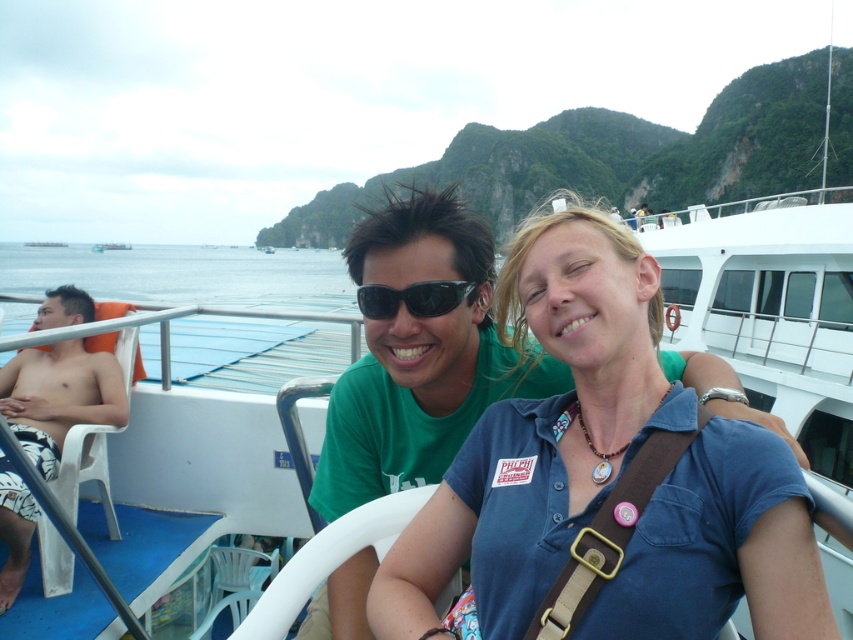
Does blue cotton shirt at center appear over white textured shorts at left?

Incorrect, blue cotton shirt at center is not positioned above white textured shorts at left.

Looking at this image, between blue cotton shirt at center and white textured shorts at left, which one appears on the right side from the viewer's perspective?

blue cotton shirt at center

Which is in front, point (519, 285) or point (41, 372)?

Point (519, 285) is more forward.

This screenshot has width=853, height=640. In order to click on blue cotton shirt at center in this screenshot , I will do `click(540, 432)`.

Between blue cotton shirt at center and black plastic sunglasses at center, which one has less height?

Standing shorter between the two is black plastic sunglasses at center.

The height and width of the screenshot is (640, 853). I want to click on blue cotton shirt at center, so click(x=540, y=432).

This screenshot has height=640, width=853. I want to click on blue cotton shirt at center, so pyautogui.click(x=540, y=432).

Is white textured shorts at left taller than white plastic boat at center?

Incorrect, white textured shorts at left's height is not larger of white plastic boat at center's.

Does white textured shorts at left come behind white plastic boat at center?

No, it is in front of white plastic boat at center.

Is point (13, 484) positioned before point (44, 243)?

Yes, it is in front of point (44, 243).

The width and height of the screenshot is (853, 640). In order to click on white textured shorts at left in this screenshot , I will do `click(57, 396)`.